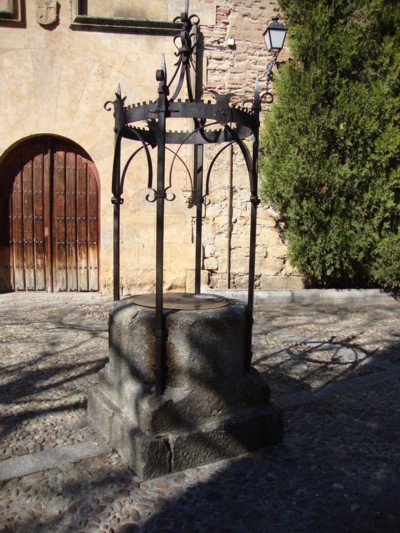
You are a GUI agent. You are given a task and a screenshot of the screen. Output one action in this format:
    pyautogui.click(x=<x>, y=<y>)
    Task: Click on the wall
    
    Given the screenshot: What is the action you would take?
    pyautogui.click(x=77, y=92)